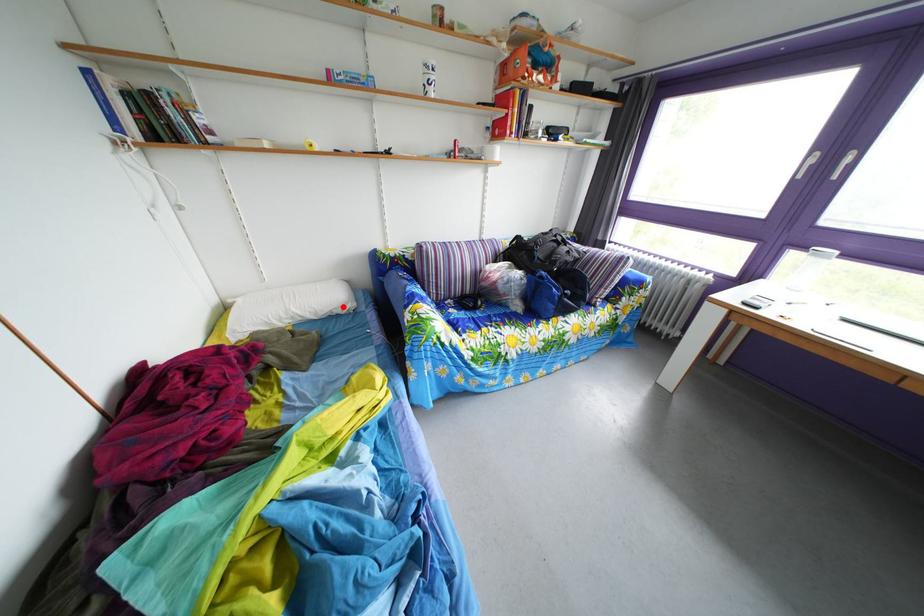
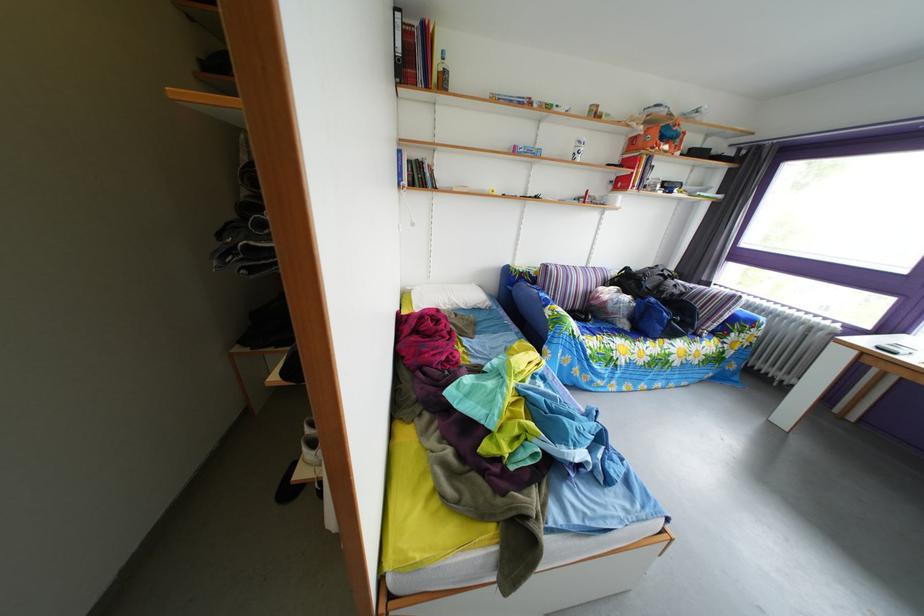
The point at the highlighted location is marked in the first image. Where is the corresponding point in the second image?

(485, 305)